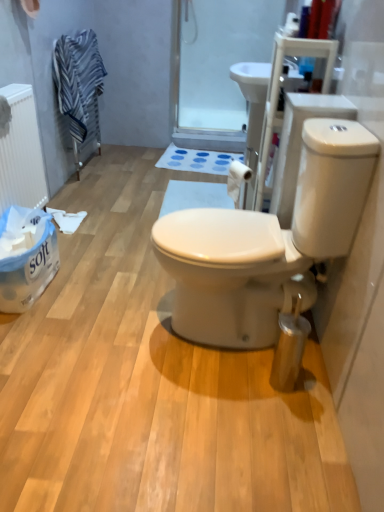
Question: Which direction should I rotate to look at transparent plastic screen door at upper center?

Choices:
 (A) right
 (B) left

Answer: (A)

Question: Is white matte radiator at left at the back of transparent plastic screen door at upper center?

Choices:
 (A) yes
 (B) no

Answer: (B)

Question: Can you confirm if transparent plastic screen door at upper center is positioned to the left of white matte radiator at left?

Choices:
 (A) yes
 (B) no

Answer: (B)

Question: Can you confirm if transparent plastic screen door at upper center is smaller than white matte radiator at left?

Choices:
 (A) no
 (B) yes

Answer: (B)

Question: Is transparent plastic screen door at upper center next to white matte radiator at left?

Choices:
 (A) no
 (B) yes

Answer: (A)

Question: Does transparent plastic screen door at upper center appear on the right side of white matte radiator at left?

Choices:
 (A) no
 (B) yes

Answer: (B)

Question: Does transparent plastic screen door at upper center come behind white matte radiator at left?

Choices:
 (A) yes
 (B) no

Answer: (A)

Question: Is white paper towel at lower left a part of striped fabric towel at upper left?

Choices:
 (A) yes
 (B) no

Answer: (B)

Question: From the image's perspective, does striped fabric towel at upper left appear higher than white paper towel at lower left?

Choices:
 (A) yes
 (B) no

Answer: (A)

Question: Is striped fabric towel at upper left not within white paper towel at lower left?

Choices:
 (A) yes
 (B) no

Answer: (A)

Question: Does striped fabric towel at upper left have a greater width compared to white paper towel at lower left?

Choices:
 (A) yes
 (B) no

Answer: (B)

Question: Considering the relative sizes of striped fabric towel at upper left and white paper towel at lower left in the image provided, is striped fabric towel at upper left smaller than white paper towel at lower left?

Choices:
 (A) yes
 (B) no

Answer: (B)

Question: Considering the relative sizes of striped fabric towel at upper left and white paper towel at lower left in the image provided, is striped fabric towel at upper left bigger than white paper towel at lower left?

Choices:
 (A) no
 (B) yes

Answer: (B)

Question: From a real-world perspective, is striped fabric towel at upper left positioned over white matte radiator at left based on gravity?

Choices:
 (A) yes
 (B) no

Answer: (A)